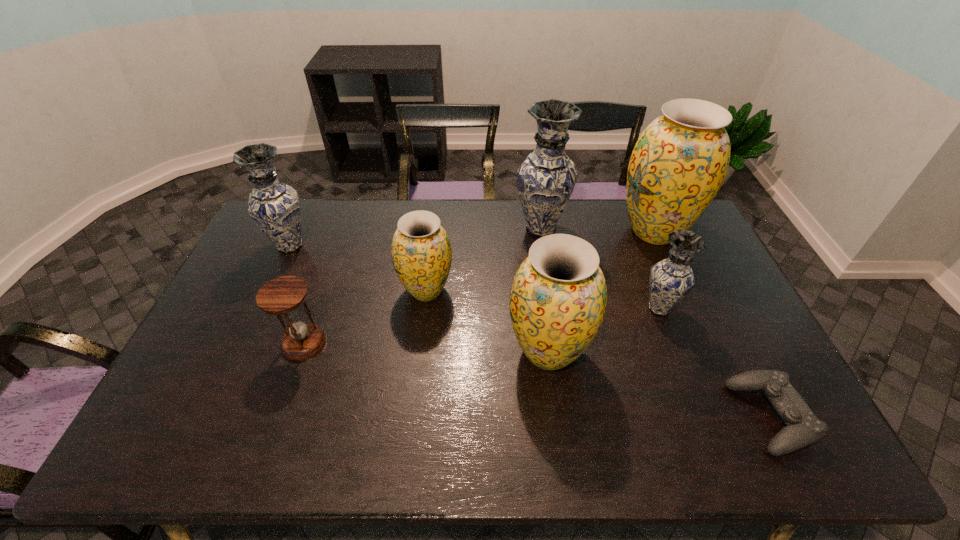
Identify the location of the second blue vase from left to right. (545, 180).

The image size is (960, 540). Identify the location of the farthest yellow vase. (680, 160).

Where is `the biggest yellow vase`? This screenshot has height=540, width=960. the biggest yellow vase is located at coordinates (680, 160).

The height and width of the screenshot is (540, 960). Find the location of `the second biggest blue vase`. the second biggest blue vase is located at coordinates (274, 206).

Identify the location of the leftmost blue vase. (274, 206).

Where is `the second biggest yellow vase`? This screenshot has height=540, width=960. the second biggest yellow vase is located at coordinates (558, 298).

The width and height of the screenshot is (960, 540). Identify the location of the nearest yellow vase. (558, 298).

At what (x,y) coordinates should I click in order to perform the action: click on the fifth vase from right to left. Please return your answer as a coordinate pair (x, y). The width and height of the screenshot is (960, 540). Looking at the image, I should click on (421, 253).

Where is `the third object from left to right`? This screenshot has width=960, height=540. the third object from left to right is located at coordinates pyautogui.click(x=421, y=253).

This screenshot has height=540, width=960. Find the location of `the rightmost blue vase`. the rightmost blue vase is located at coordinates (671, 279).